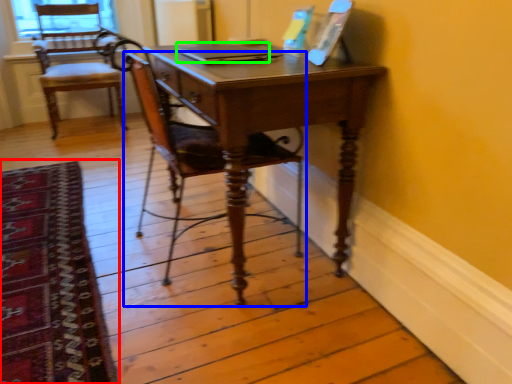
Question: Considering the real-world distances, which object is closest to mat (highlighted by a red box)? chair (highlighted by a blue box) or laptop (highlighted by a green box).

Choices:
 (A) chair
 (B) laptop

Answer: (A)